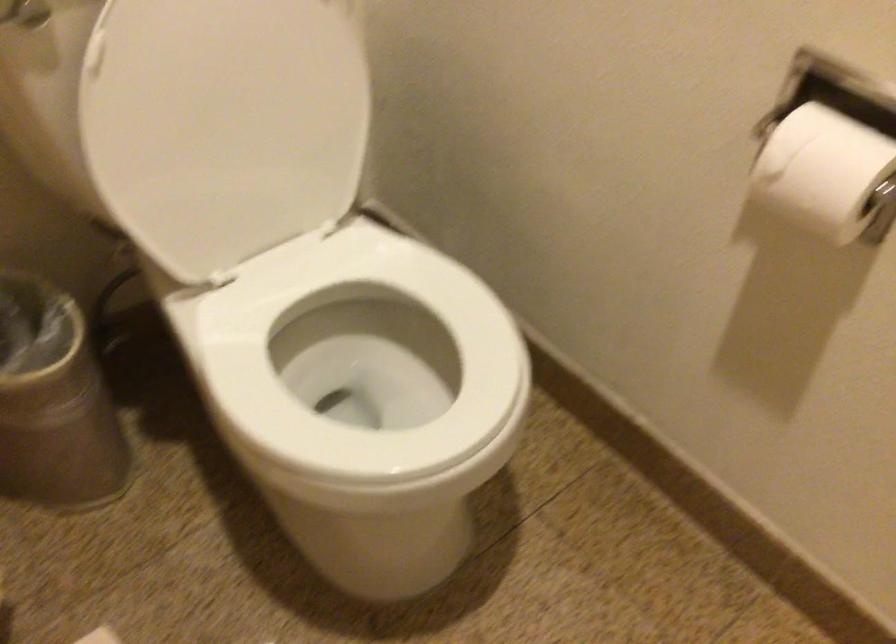
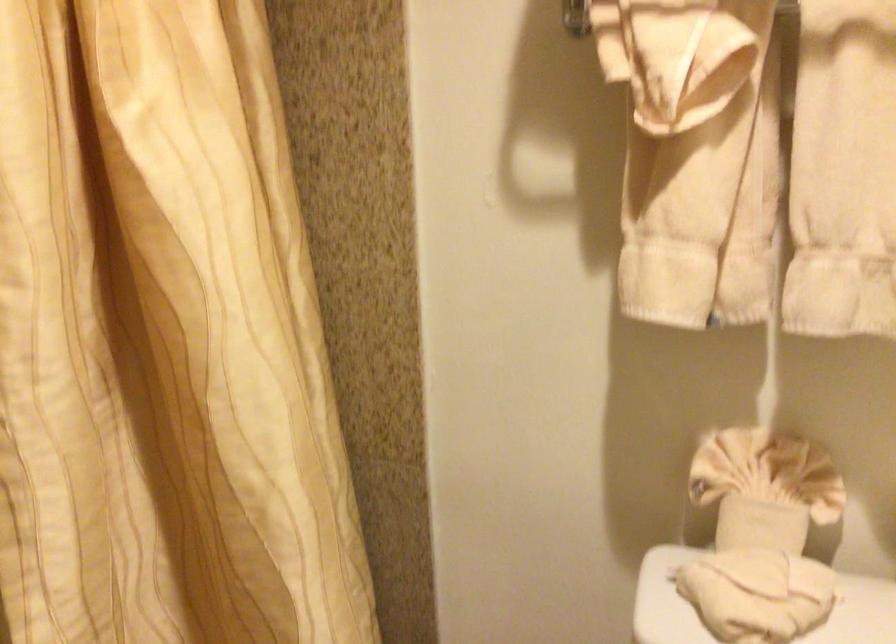
Question: The images are taken continuously from a first-person perspective. In which direction is your viewpoint rotating?

Choices:
 (A) Left
 (B) Right
 (C) Up
 (D) Down

Answer: (A)